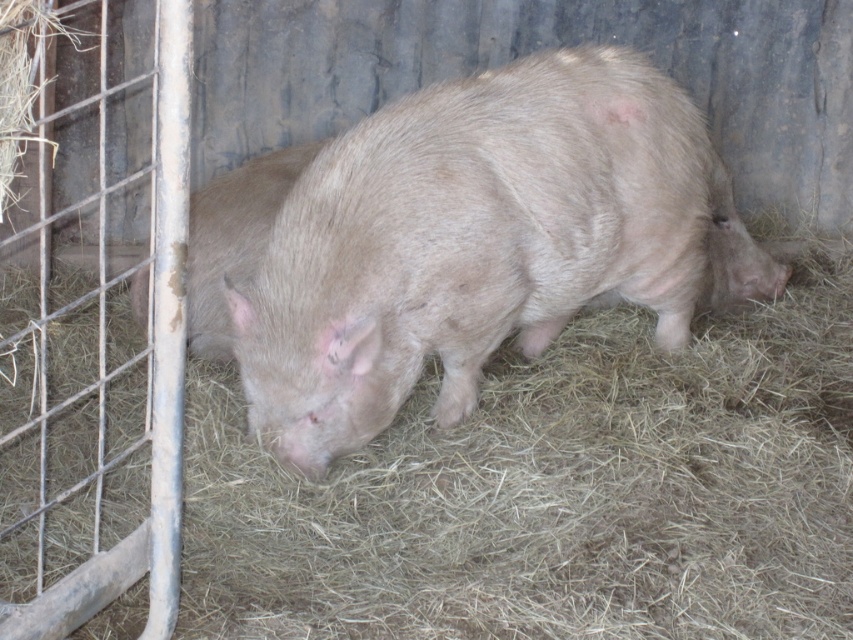
You are standing in the barn and need to place a new feeding trough. The fuzzy brown pig at center is currently at position coordinates 0.378, 0.566. Where should you place the trough so it is directly in front of the pig?

The fuzzy brown pig at center is located at point [482,241]. To place the feeding trough directly in front of it, position the trough at coordinates slightly ahead of [482,241] along the pig s line of sight, ensuring it is within the pig s reachable area.